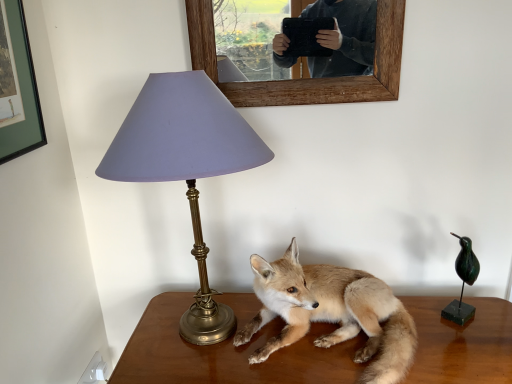
Question: Is wooden picture frame at upper center wider than brown wooden table at center?

Choices:
 (A) no
 (B) yes

Answer: (A)

Question: Is wooden picture frame at upper center closer to camera compared to brown wooden table at center?

Choices:
 (A) yes
 (B) no

Answer: (B)

Question: Is wooden picture frame at upper center looking in the opposite direction of brown wooden table at center?

Choices:
 (A) yes
 (B) no

Answer: (B)

Question: Is wooden picture frame at upper center taller than brown wooden table at center?

Choices:
 (A) yes
 (B) no

Answer: (B)

Question: Is wooden picture frame at upper center thinner than brown wooden table at center?

Choices:
 (A) yes
 (B) no

Answer: (A)

Question: Would you say wooden picture frame at upper center is outside brown wooden table at center?

Choices:
 (A) yes
 (B) no

Answer: (A)

Question: Does brown wooden table at center have a lesser width compared to matte purple shade at left?

Choices:
 (A) yes
 (B) no

Answer: (B)

Question: Is matte purple shade at left inside brown wooden table at center?

Choices:
 (A) no
 (B) yes

Answer: (A)

Question: From a real-world perspective, is brown wooden table at center located higher than matte purple shade at left?

Choices:
 (A) no
 (B) yes

Answer: (A)

Question: From the image's perspective, does brown wooden table at center appear higher than matte purple shade at left?

Choices:
 (A) no
 (B) yes

Answer: (A)

Question: Is brown wooden table at center oriented towards matte purple shade at left?

Choices:
 (A) no
 (B) yes

Answer: (A)

Question: From the image's perspective, is brown wooden table at center located beneath matte purple shade at left?

Choices:
 (A) no
 (B) yes

Answer: (B)

Question: Is furry golden fox at center inside brown wooden table at center?

Choices:
 (A) yes
 (B) no

Answer: (B)